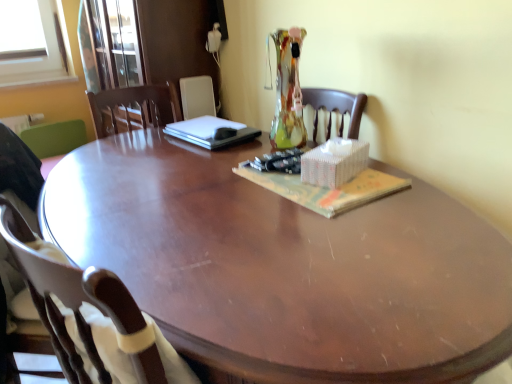
Question: Is point (1, 231) closer or farther from the camera than point (4, 231)?

Choices:
 (A) closer
 (B) farther

Answer: (A)

Question: Relative to brown wood chair at lower left, the first chair in the front-to-back sequence, is brown wood chair at lower left, the second chair in the back-to-front sequence, in front or behind?

Choices:
 (A) behind
 (B) front

Answer: (A)

Question: Which object is the farthest from the green fabric chair at left, the 1th chair from the back?

Choices:
 (A) brown wood chair at lower left, the second chair in the back-to-front sequence
 (B) sleek black laptop at center
 (C) brown wood chair at lower left, marked as the 3th chair in a back-to-front arrangement
 (D) glossy wood desk at center
 (E) matte paper magazine at center

Answer: (A)

Question: Which object is positioned farthest from the glossy wood desk at center?

Choices:
 (A) green fabric chair at left, the 1th chair from the back
 (B) brown wood chair at lower left, the first chair in the front-to-back sequence
 (C) sleek black laptop at center
 (D) brown wood chair at lower left, positioned as the second chair in front-to-back order
 (E) matte paper magazine at center

Answer: (A)